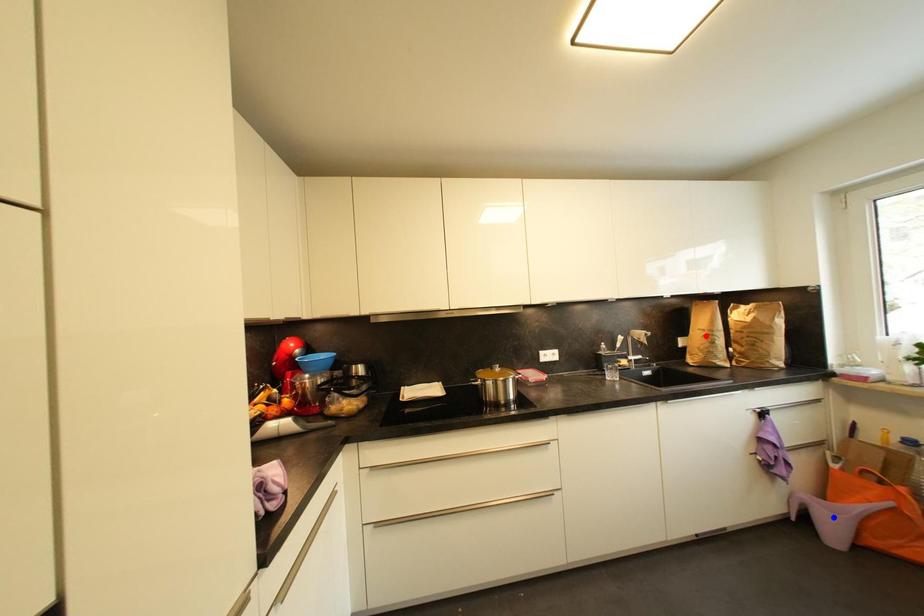
Question: Two points are marked on the image. Which point is closer to the camera?

Choices:
 (A) Blue point is closer.
 (B) Red point is closer.

Answer: (A)